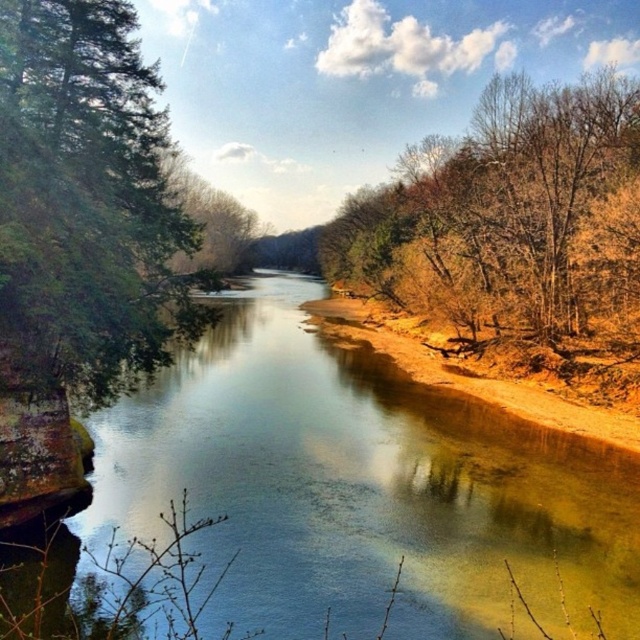
Who is positioned more to the left, clear water at center or brown leafy tree at right?

From the viewer's perspective, clear water at center appears more on the left side.

Based on the photo, can you confirm if clear water at center is bigger than brown leafy tree at right?

Actually, clear water at center might be smaller than brown leafy tree at right.

This screenshot has height=640, width=640. What are the coordinates of `clear water at center` in the screenshot? It's located at (356, 488).

Who is lower down, green textured tree at left or brown leafy tree at right?

green textured tree at left

Describe the element at coordinates (84, 205) in the screenshot. I see `green textured tree at left` at that location.

Where is `green textured tree at left`? Image resolution: width=640 pixels, height=640 pixels. green textured tree at left is located at coordinates (84, 205).

Can you confirm if clear water at center is taller than green textured tree at left?

No, clear water at center is not taller than green textured tree at left.

Does clear water at center have a smaller size compared to green textured tree at left?

No, clear water at center is not smaller than green textured tree at left.

Is point (225, 424) farther from viewer compared to point (44, 362)?

Yes.

This screenshot has width=640, height=640. Find the location of `clear water at center`. clear water at center is located at coordinates (356, 488).